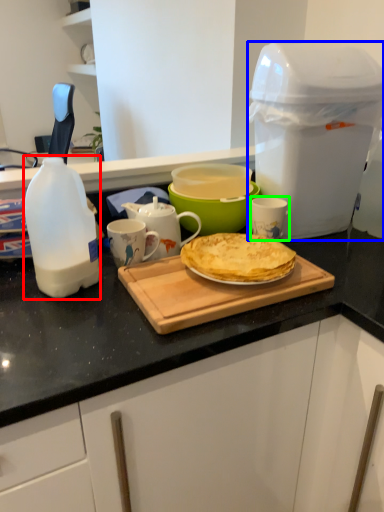
Question: Considering the real-world distances, which object is closest to bottle (highlighted by a red box)? appliance (highlighted by a blue box) or mug (highlighted by a green box).

Choices:
 (A) appliance
 (B) mug

Answer: (B)